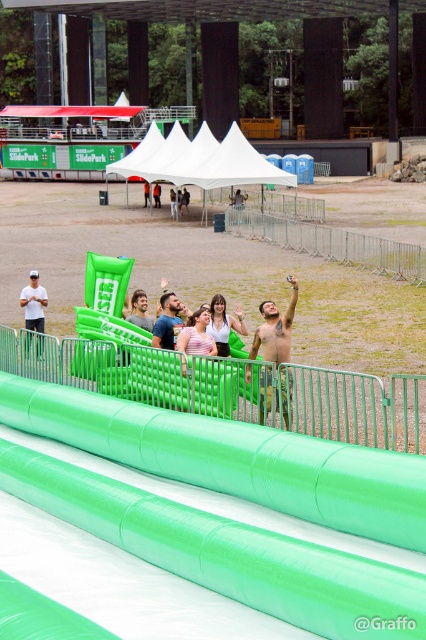
You are standing at the entrance of the SlidePark and want to locate the shiny metallic tank top at upper right. According to the coordinates provided, where exactly is it positioned in the image?

The shiny metallic tank top at upper right is located at point coordinates 0.516 on the x axis and 0.646 on the y axis.